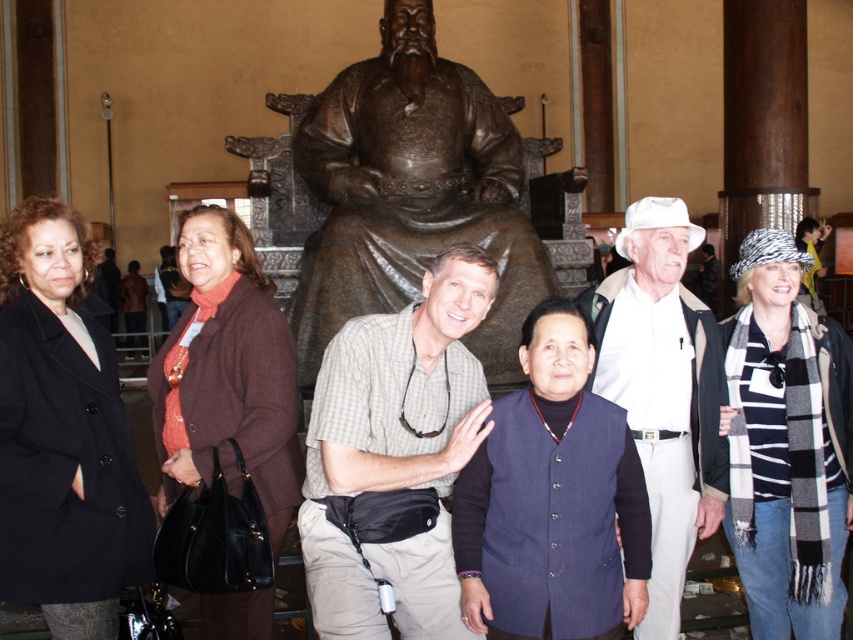
You are standing in front of the bronze statue at center and the checkered fabric shirt at center. Which object is positioned to the left?

The bronze statue at center is to the left of the checkered fabric shirt at center.

You are a photographer trying to capture a group photo. The bronze statue at center and the checkered fabric shirt at center are both in the frame. Which object is wider?

The bronze statue at center is wider than the checkered fabric shirt at center according to the description.

You are a photographer trying to capture a clear shot of the checkered fabric shirt at center and the white cotton hat at center. Which object should you focus on first if you want to ensure both are in focus, given their heights?

The checkered fabric shirt at center has a lesser height compared to white cotton hat at center, so you should focus on the white cotton hat at center first to ensure both are in focus.